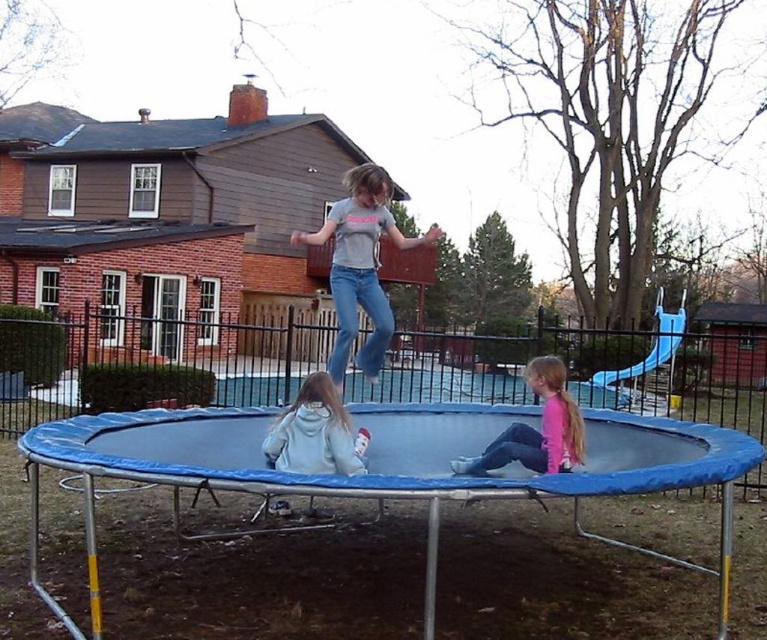
Question: Can you confirm if blue trampoline at center is positioned above matte gray t-shirt at center?

Choices:
 (A) yes
 (B) no

Answer: (B)

Question: Which point is farther to the camera?

Choices:
 (A) (522, 381)
 (B) (301, 432)
 (C) (463, 470)

Answer: (A)

Question: Which object is closer to the camera taking this photo?

Choices:
 (A) pink matte shirt at lower center
 (B) matte gray t-shirt at center

Answer: (A)

Question: Can you confirm if matte gray t-shirt at center is positioned above light gray hoodie at center?

Choices:
 (A) yes
 (B) no

Answer: (A)

Question: Can you confirm if pink matte shirt at lower center is bigger than light gray hoodie at center?

Choices:
 (A) no
 (B) yes

Answer: (B)

Question: Which point is closer to the camera?

Choices:
 (A) pink matte shirt at lower center
 (B) blue trampoline at center
 (C) light gray hoodie at center
 (D) matte gray t-shirt at center

Answer: (C)